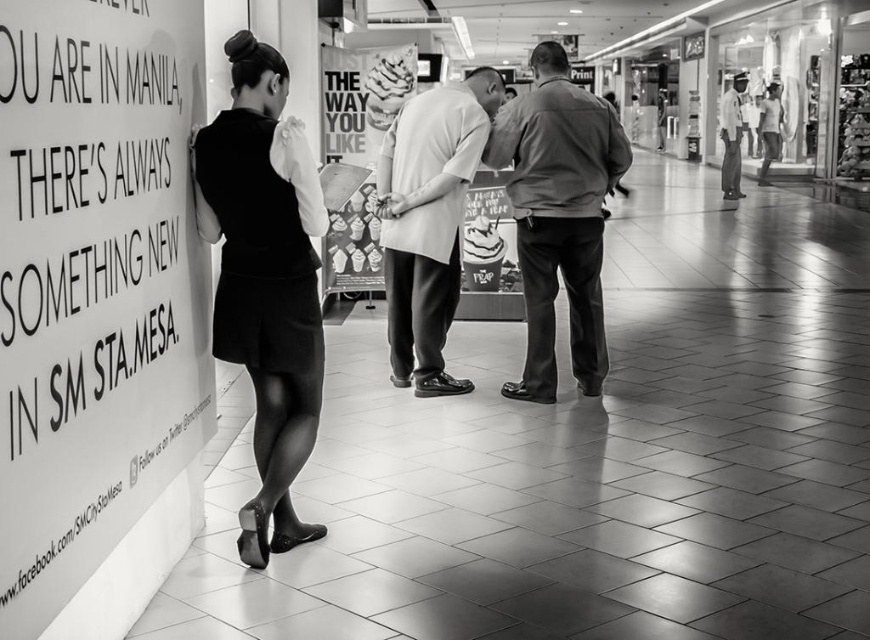
You are a delivery person who needs to place a small package between the smooth paper sign at left and the matte black dress at left. Can you fit the package in the space between them?

The smooth paper sign at left and the matte black dress at left are 20.26 inches apart from each other, so yes, the package can be placed between them as the distance is sufficient.